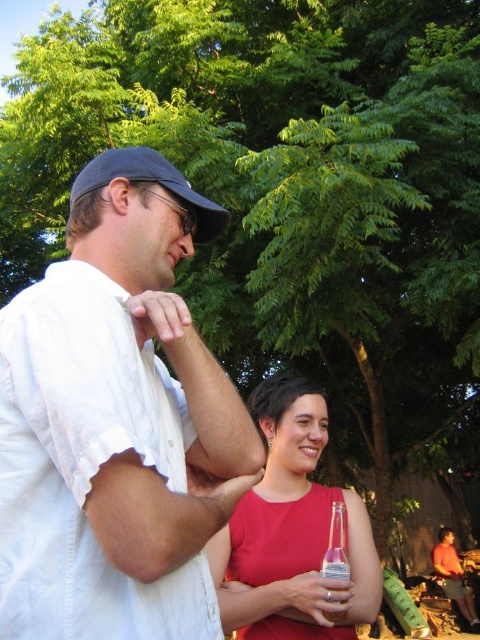
Which of these two, matte red dress at center or clear glass bottle at center, stands shorter?

clear glass bottle at center is shorter.

Is matte red dress at center shorter than clear glass bottle at center?

No, matte red dress at center is not shorter than clear glass bottle at center.

Between point (369, 618) and point (343, 504), which one is positioned behind?

The point (343, 504) is behind.

Find the location of a particular element. This screenshot has width=480, height=640. matte red dress at center is located at coordinates (291, 531).

Is white cotton shirt at left positioned behind clear glass bottle at center?

That is False.

You are a GUI agent. You are given a task and a screenshot of the screen. Output one action in this format:
    pyautogui.click(x=<x>, y=<y>)
    Task: Click on the white cotton shirt at left
    This screenshot has height=640, width=480.
    Given the screenshot: What is the action you would take?
    pyautogui.click(x=113, y=422)

Does white cotton shirt at left appear over matte red dress at center?

Indeed, white cotton shirt at left is positioned over matte red dress at center.

Can you confirm if white cotton shirt at left is positioned to the right of matte red dress at center?

Incorrect, white cotton shirt at left is not on the right side of matte red dress at center.

Does point (214, 212) come in front of point (347, 513)?

Yes, point (214, 212) is in front of point (347, 513).

Identify the location of white cotton shirt at left. (113, 422).